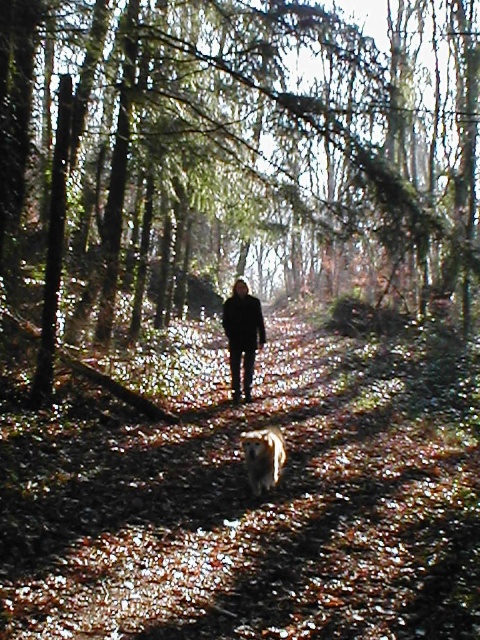
You are a hiker trying to follow the brown leafy forest path at center in the forest. There is a green leafy tree at center nearby. Which side of the path should you avoid to stay on the trail?

You should avoid the right side of the brown leafy forest path at center because the green leafy tree at center is positioned on the right side of it, so staying to the left would keep you on the path.

You are standing at the starting point of the path in the forest. There is a green leafy tree at center. Which direction should you walk to reach the tree?

The green leafy tree at center is located at point [237,157], so you should walk towards the center of the image to reach it.